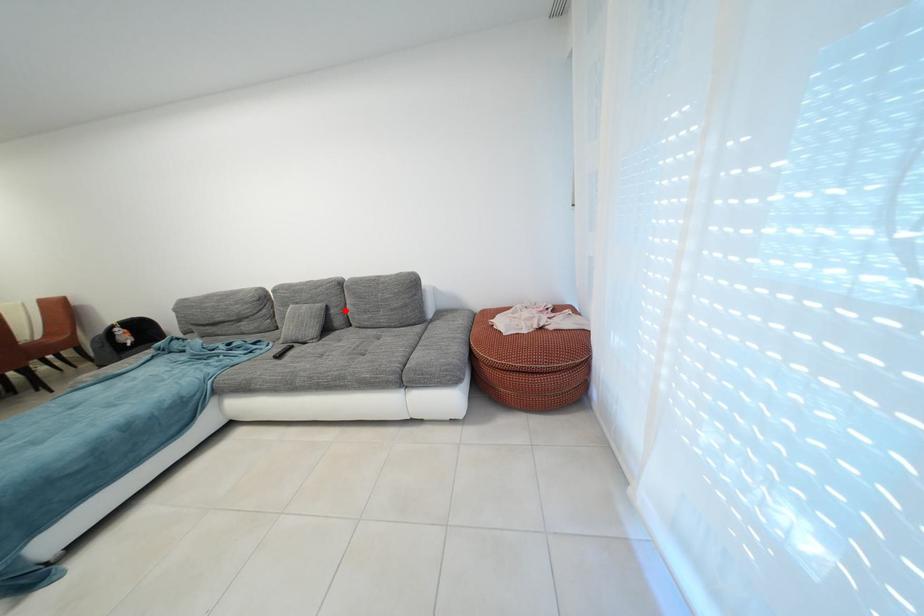
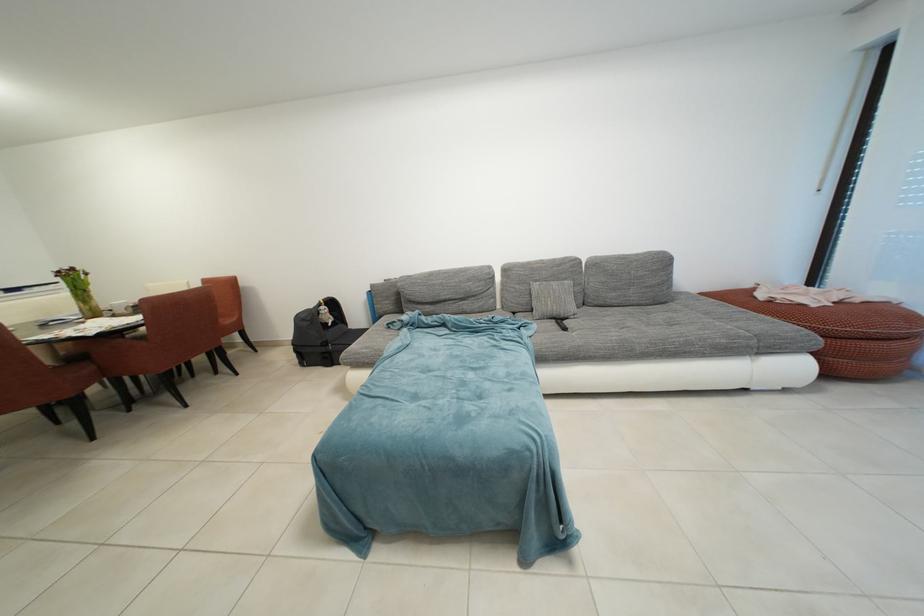
Locate, in the second image, the point that corresponds to the highlighted location in the first image.

(588, 289)